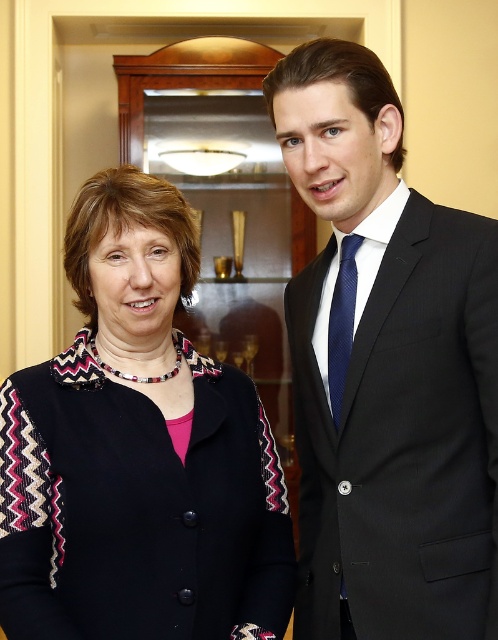
Who is taller, black suit at right or navy silk tie at right?

With more height is black suit at right.

Does black suit at right appear on the right side of navy silk tie at right?

Indeed, black suit at right is positioned on the right side of navy silk tie at right.

Who is more forward, (315, 592) or (333, 413)?

Point (333, 413)

Locate an element on the screen. The image size is (498, 640). black suit at right is located at coordinates (386, 369).

Is black suit at right to the left of black knitted sweater at center from the viewer's perspective?

In fact, black suit at right is to the right of black knitted sweater at center.

I want to click on black suit at right, so click(386, 369).

Which is below, black knitted sweater at center or navy silk tie at right?

black knitted sweater at center is lower down.

Can you confirm if black knitted sweater at center is positioned to the left of navy silk tie at right?

Yes, black knitted sweater at center is to the left of navy silk tie at right.

Locate an element on the screen. black knitted sweater at center is located at coordinates (138, 452).

You are a GUI agent. You are given a task and a screenshot of the screen. Output one action in this format:
    pyautogui.click(x=<x>, y=<y>)
    Task: Click on the black knitted sweater at center
    The image size is (498, 640).
    Given the screenshot: What is the action you would take?
    pyautogui.click(x=138, y=452)